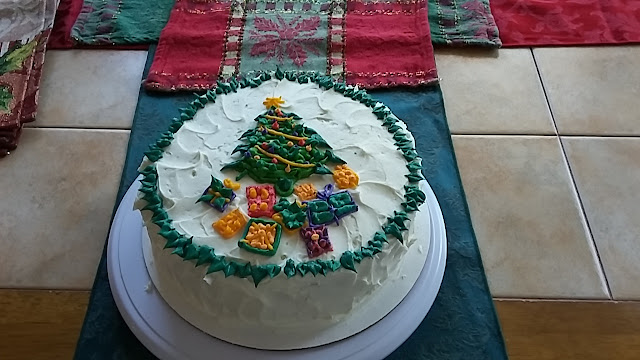
Locate an element on the screen. The width and height of the screenshot is (640, 360). tiles counter is located at coordinates (486, 103), (598, 119), (584, 218), (537, 234), (58, 188), (92, 94).